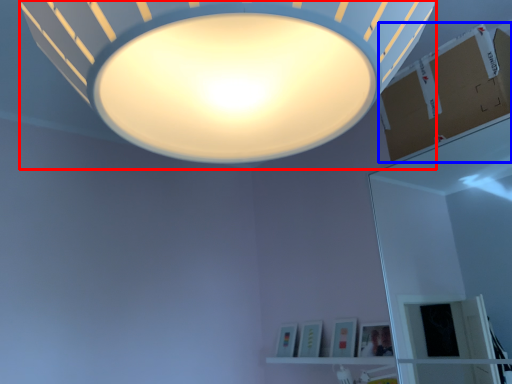
Question: Which of the following is the farthest to the observer, lamp (highlighted by a red box) or cardboard box (highlighted by a blue box)?

Choices:
 (A) lamp
 (B) cardboard box

Answer: (B)